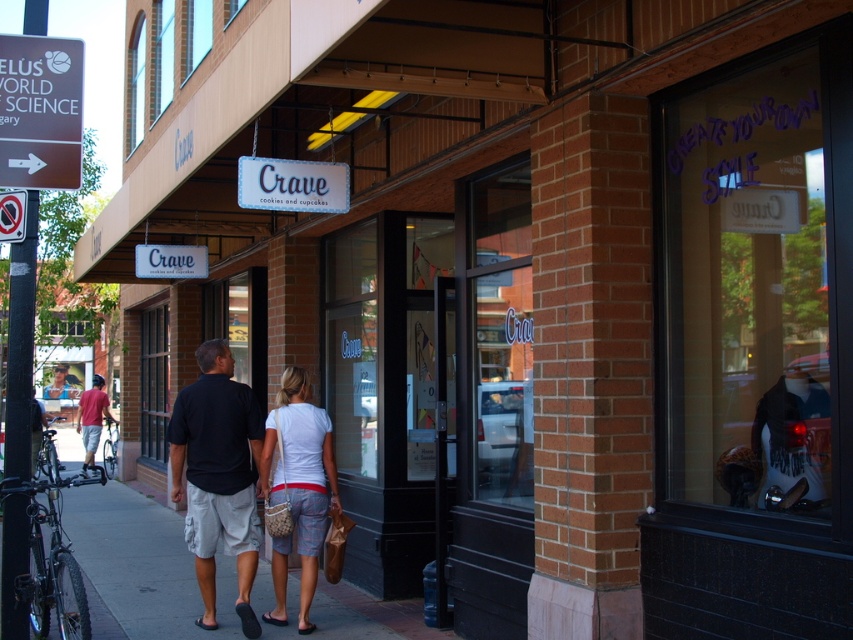
From the picture: You are a photographer standing on the sidewalk in front of the Crave storefront. You want to take a photo that includes both the white woven purse at center and the matte red shirt at left. Which object should you focus on first to ensure both are in focus?

The white woven purse at center is closer to the viewer than the matte red shirt at left. To ensure both are in focus, you should focus on the white woven purse at center first, as it is the closer object, and adjust the depth of field to include the matte red shirt at left in the background.